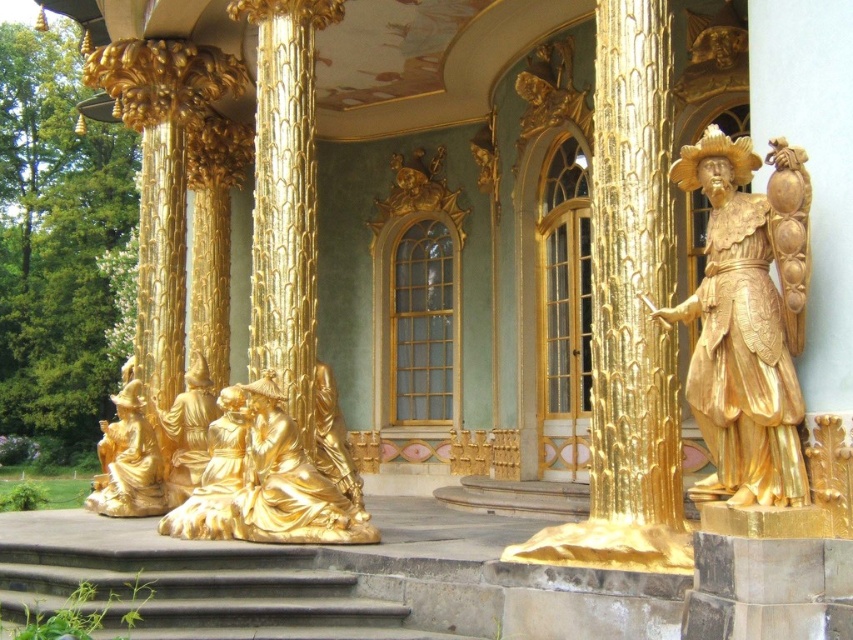
Is point (292, 512) positioned in front of point (212, 538)?

Yes, point (292, 512) is closer to viewer.

This screenshot has width=853, height=640. Describe the element at coordinates (234, 467) in the screenshot. I see `gold/gilded statue at lower left` at that location.

Which is behind, point (120, 506) or point (231, 452)?

Point (120, 506)

Where is `gold/gilded statue at lower left`? The height and width of the screenshot is (640, 853). gold/gilded statue at lower left is located at coordinates (234, 467).

Is gold polished statue at lower center bigger than gold/gilded statue at lower center?

Actually, gold polished statue at lower center might be smaller than gold/gilded statue at lower center.

What do you see at coordinates (289, 483) in the screenshot? I see `gold polished statue at lower center` at bounding box center [289, 483].

Is point (287, 522) farther from camera compared to point (213, 426)?

No.

The height and width of the screenshot is (640, 853). What are the coordinates of `gold polished statue at lower center` in the screenshot? It's located at (289, 483).

Who is more forward, (303, 492) or (187, 484)?

Point (303, 492) is more forward.

Is point (291, 531) in front of point (184, 408)?

Yes, point (291, 531) is closer to viewer.

What do you see at coordinates (289, 483) in the screenshot?
I see `gold polished statue at lower center` at bounding box center [289, 483].

Where is `gold polished statue at lower center`? gold polished statue at lower center is located at coordinates (289, 483).